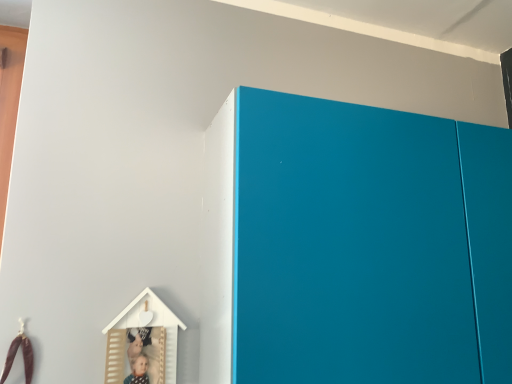
Where is `matte blue cabinet at upper right`? The image size is (512, 384). matte blue cabinet at upper right is located at coordinates (354, 245).

The width and height of the screenshot is (512, 384). Describe the element at coordinates (354, 245) in the screenshot. I see `matte blue cabinet at upper right` at that location.

Where is `brown leather toy at lower left, the 2th toy from the right`? brown leather toy at lower left, the 2th toy from the right is located at coordinates (16, 353).

From a real-world perspective, does white matte wooden house at lower left, which is the 1th toy from right to left, sit lower than brown leather toy at lower left, the 1th toy when ordered from left to right?

No.

From the picture: From their relative heights in the image, would you say white matte wooden house at lower left, which is the 1th toy from right to left, is taller or shorter than brown leather toy at lower left, the 1th toy when ordered from left to right?

white matte wooden house at lower left, which is the 1th toy from right to left, is taller than brown leather toy at lower left, the 1th toy when ordered from left to right.

Is point (106, 381) positioned after point (1, 381)?

Yes, point (106, 381) is farther from viewer.

Looking at their sizes, would you say white matte wooden house at lower left, arranged as the second toy when viewed from the left, is wider or thinner than brown leather toy at lower left, the 1th toy when ordered from left to right?

Considering their sizes, white matte wooden house at lower left, arranged as the second toy when viewed from the left, looks broader than brown leather toy at lower left, the 1th toy when ordered from left to right.

Considering the relative positions of brown leather toy at lower left, the 2th toy from the right, and matte blue cabinet at upper right in the image provided, is brown leather toy at lower left, the 2th toy from the right, to the left or to the right of matte blue cabinet at upper right?

brown leather toy at lower left, the 2th toy from the right, is positioned on matte blue cabinet at upper right's left side.

From the image's perspective, which is below, brown leather toy at lower left, the 2th toy from the right, or matte blue cabinet at upper right?

From the image's view, brown leather toy at lower left, the 2th toy from the right, is below.

Which is less distant, (x=32, y=366) or (x=433, y=154)?

Point (x=32, y=366) is positioned closer to the camera compared to point (x=433, y=154).

Considering the relative sizes of brown leather toy at lower left, the 1th toy when ordered from left to right, and matte blue cabinet at upper right in the image provided, is brown leather toy at lower left, the 1th toy when ordered from left to right, wider than matte blue cabinet at upper right?

In fact, brown leather toy at lower left, the 1th toy when ordered from left to right, might be narrower than matte blue cabinet at upper right.

What's the angular difference between white matte wooden house at lower left, which is the 1th toy from right to left, and matte blue cabinet at upper right's facing directions?

The facing directions of white matte wooden house at lower left, which is the 1th toy from right to left, and matte blue cabinet at upper right are 0.000527 degrees apart.

Which point is more forward, (150, 336) or (485, 309)?

Point (485, 309)

This screenshot has width=512, height=384. I want to click on cupboard above the white matte wooden house at lower left, arranged as the second toy when viewed from the left (from the image's perspective), so click(354, 245).

Does white matte wooden house at lower left, which is the 1th toy from right to left, have a lesser height compared to matte blue cabinet at upper right?

Indeed, white matte wooden house at lower left, which is the 1th toy from right to left, has a lesser height compared to matte blue cabinet at upper right.

In the image, is matte blue cabinet at upper right positioned in front of or behind brown leather toy at lower left, the 1th toy when ordered from left to right?

matte blue cabinet at upper right is in front of brown leather toy at lower left, the 1th toy when ordered from left to right.

From the image's perspective, is matte blue cabinet at upper right beneath brown leather toy at lower left, the 1th toy when ordered from left to right?

No.

Do you think matte blue cabinet at upper right is within brown leather toy at lower left, the 2th toy from the right, or outside of it?

matte blue cabinet at upper right is not inside brown leather toy at lower left, the 2th toy from the right, it's outside.

Can you confirm if matte blue cabinet at upper right is positioned to the left of brown leather toy at lower left, the 2th toy from the right?

In fact, matte blue cabinet at upper right is to the right of brown leather toy at lower left, the 2th toy from the right.

Is brown leather toy at lower left, the 1th toy when ordered from left to right, positioned with its back to white matte wooden house at lower left, which is the 1th toy from right to left?

No, brown leather toy at lower left, the 1th toy when ordered from left to right,'s orientation is not away from white matte wooden house at lower left, which is the 1th toy from right to left.

Considering the positions of objects brown leather toy at lower left, the 1th toy when ordered from left to right, and white matte wooden house at lower left, arranged as the second toy when viewed from the left, in the image provided, who is more to the right, brown leather toy at lower left, the 1th toy when ordered from left to right, or white matte wooden house at lower left, arranged as the second toy when viewed from the left,?

From the viewer's perspective, white matte wooden house at lower left, arranged as the second toy when viewed from the left, appears more on the right side.

Considering the relative sizes of matte blue cabinet at upper right and white matte wooden house at lower left, arranged as the second toy when viewed from the left, in the image provided, is matte blue cabinet at upper right taller than white matte wooden house at lower left, arranged as the second toy when viewed from the left,?

Indeed, matte blue cabinet at upper right has a greater height compared to white matte wooden house at lower left, arranged as the second toy when viewed from the left.

Can you confirm if matte blue cabinet at upper right is bigger than white matte wooden house at lower left, which is the 1th toy from right to left?

Correct, matte blue cabinet at upper right is larger in size than white matte wooden house at lower left, which is the 1th toy from right to left.

What's the angular difference between matte blue cabinet at upper right and white matte wooden house at lower left, arranged as the second toy when viewed from the left,'s facing directions?

0.000527 degrees separate the facing orientations of matte blue cabinet at upper right and white matte wooden house at lower left, arranged as the second toy when viewed from the left.

Looking at this image, how distant is matte blue cabinet at upper right from white matte wooden house at lower left, which is the 1th toy from right to left?

They are 53.71 centimeters apart.

You are a GUI agent. You are given a task and a screenshot of the screen. Output one action in this format:
    pyautogui.click(x=<x>, y=<y>)
    Task: Click on the toy on the left of white matte wooden house at lower left, arranged as the second toy when viewed from the left
    The width and height of the screenshot is (512, 384).
    Given the screenshot: What is the action you would take?
    pyautogui.click(x=16, y=353)

Locate an element on the screen. The width and height of the screenshot is (512, 384). the 2nd toy located beneath the matte blue cabinet at upper right (from a real-world perspective) is located at coordinates (16, 353).

Considering their positions, is brown leather toy at lower left, the 2th toy from the right, positioned closer to white matte wooden house at lower left, which is the 1th toy from right to left, than matte blue cabinet at upper right?

The object closer to white matte wooden house at lower left, which is the 1th toy from right to left, is brown leather toy at lower left, the 2th toy from the right.

Considering their positions, is brown leather toy at lower left, the 1th toy when ordered from left to right, positioned closer to matte blue cabinet at upper right than white matte wooden house at lower left, arranged as the second toy when viewed from the left?

white matte wooden house at lower left, arranged as the second toy when viewed from the left, is closer to matte blue cabinet at upper right.

From the image, which object appears to be nearer to white matte wooden house at lower left, arranged as the second toy when viewed from the left, matte blue cabinet at upper right or brown leather toy at lower left, the 1th toy when ordered from left to right?

Based on the image, brown leather toy at lower left, the 1th toy when ordered from left to right, appears to be nearer to white matte wooden house at lower left, arranged as the second toy when viewed from the left.

Estimate the real-world distances between objects in this image. Which object is further from brown leather toy at lower left, the 2th toy from the right, matte blue cabinet at upper right or white matte wooden house at lower left, which is the 1th toy from right to left?

Based on the image, matte blue cabinet at upper right appears to be further to brown leather toy at lower left, the 2th toy from the right.

Estimate the real-world distances between objects in this image. Which object is further from matte blue cabinet at upper right, white matte wooden house at lower left, arranged as the second toy when viewed from the left, or brown leather toy at lower left, the 1th toy when ordered from left to right?

Based on the image, brown leather toy at lower left, the 1th toy when ordered from left to right, appears to be further to matte blue cabinet at upper right.

Estimate the real-world distances between objects in this image. Which object is further from brown leather toy at lower left, the 1th toy when ordered from left to right, white matte wooden house at lower left, arranged as the second toy when viewed from the left, or matte blue cabinet at upper right?

matte blue cabinet at upper right is further to brown leather toy at lower left, the 1th toy when ordered from left to right.

At what (x,y) coordinates should I click in order to perform the action: click on toy between brown leather toy at lower left, the 1th toy when ordered from left to right, and matte blue cabinet at upper right. Please return your answer as a coordinate pair (x, y). The width and height of the screenshot is (512, 384). Looking at the image, I should click on (142, 343).